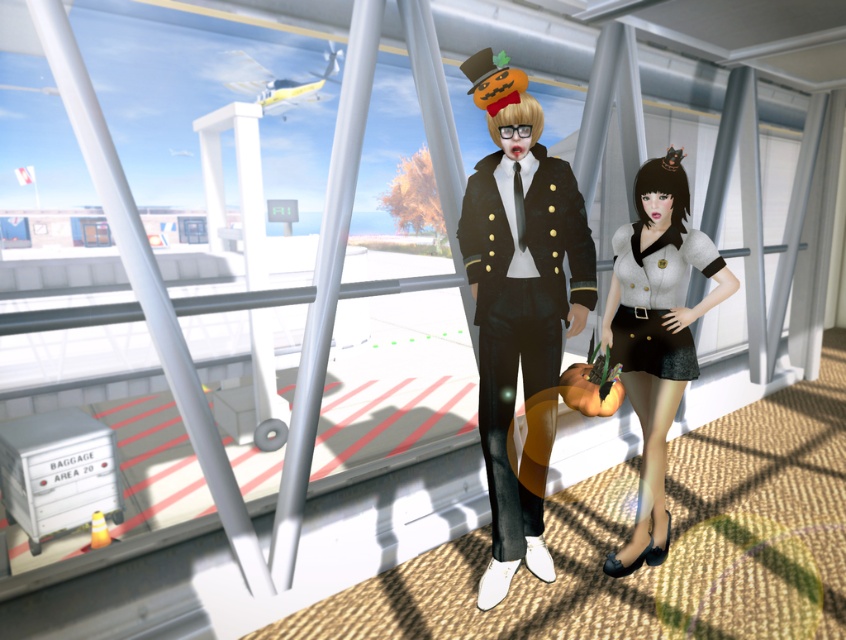
You are a photographer positioned at the back of the terminal. You want to take a photo of both the shiny black uniform at center and the white woolen dress at center. Which one will appear larger in your photo?

The shiny black uniform at center will appear larger in the photo because it is closer to the viewer than the white woolen dress at center.

Consider the image. You are standing at the entrance of the airport terminal and want to reach a specific point marked as point [506,474]. If your maximum comfortable walking distance is 8 feet, can you comfortably reach that point without straining?

The distance of point [506,474] from the camera is 7.70 feet, which is within your maximum comfortable walking distance of 8 feet. Therefore, you can comfortably reach that point without straining.